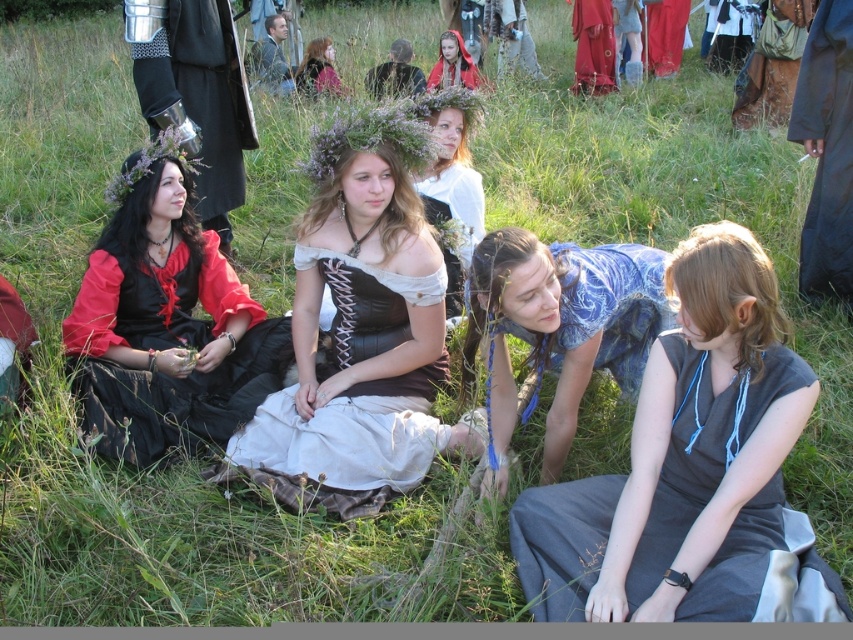
From the picture: Who is more forward, (204, 344) or (816, 102)?

Point (204, 344)

Is matte black dress at left positioned in front of dark gray fabric cloak at right?

Yes.

In order to click on matte black dress at left in this screenshot , I will do `click(165, 323)`.

Can you confirm if gray fabric dress at lower right is shorter than matte black dress at left?

Correct, gray fabric dress at lower right is not as tall as matte black dress at left.

Who is higher up, gray fabric dress at lower right or matte black dress at left?

matte black dress at left is above.

Which is behind, point (798, 385) or point (142, 232)?

Point (142, 232)

Find the location of a particular element. This screenshot has width=853, height=640. gray fabric dress at lower right is located at coordinates point(692,470).

Is matte red skirt at upper right to the left of brown leather belt at center from the viewer's perspective?

No, matte red skirt at upper right is not to the left of brown leather belt at center.

Does point (659, 72) come closer to viewer compared to point (318, 77)?

No, (659, 72) is behind (318, 77).

Find the location of a particular element. This screenshot has width=853, height=640. matte red skirt at upper right is located at coordinates (665, 35).